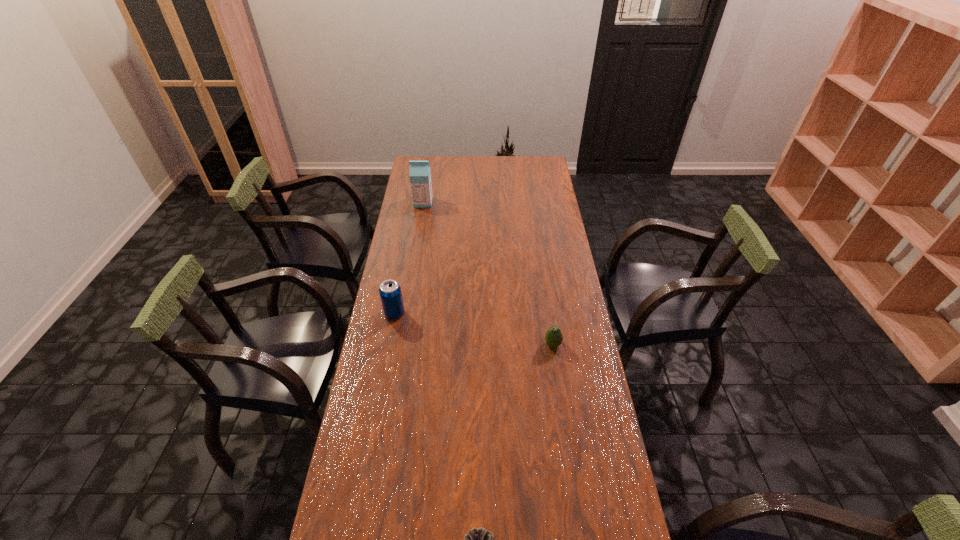
Identify the location of vacant space that is in between the farthest object and the rightmost object. The image size is (960, 540). (488, 273).

Locate an element on the screen. The height and width of the screenshot is (540, 960). the closest object to the second farthest object is located at coordinates (553, 337).

Locate an element on the screen. object that is the closest to the milk carton is located at coordinates (390, 292).

Identify the location of vacant region that satisfies the following two spatial constraints: 1. on the front side of the second nearest object; 2. on the right side of the tallest object. The height and width of the screenshot is (540, 960). (400, 345).